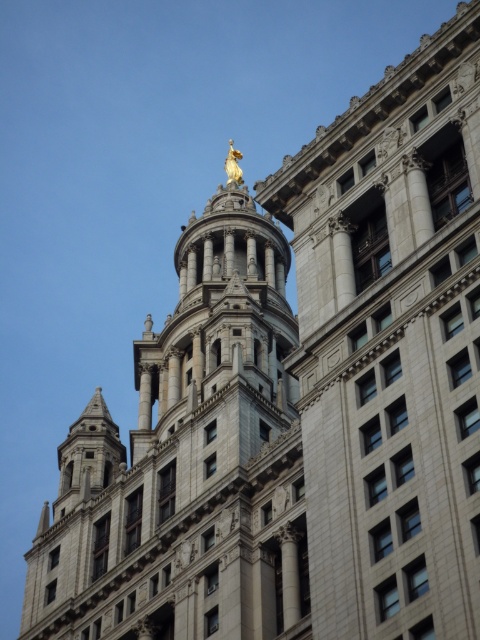
Question: Is gray stone tower at center below gold polished statue at upper center?

Choices:
 (A) no
 (B) yes

Answer: (B)

Question: Can you confirm if gray stone tower at center is bigger than gold polished statue at upper center?

Choices:
 (A) no
 (B) yes

Answer: (A)

Question: Which object is closer to the camera taking this photo?

Choices:
 (A) gray stone tower at center
 (B) gold polished statue at upper center

Answer: (A)

Question: Which point is farther to the camera?

Choices:
 (A) gold polished statue at upper center
 (B) gray stone tower at center

Answer: (A)

Question: Is gray stone tower at center thinner than gold polished statue at upper center?

Choices:
 (A) no
 (B) yes

Answer: (B)